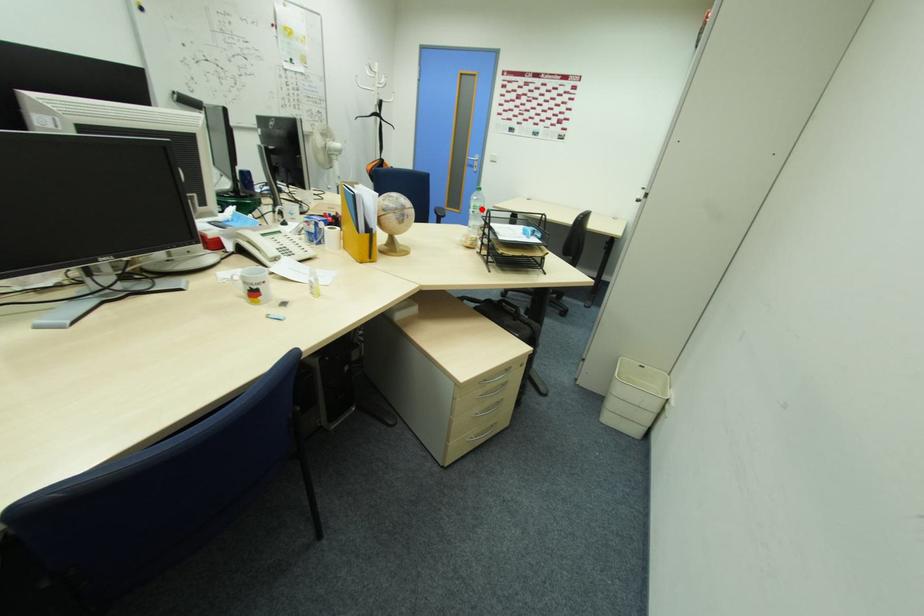
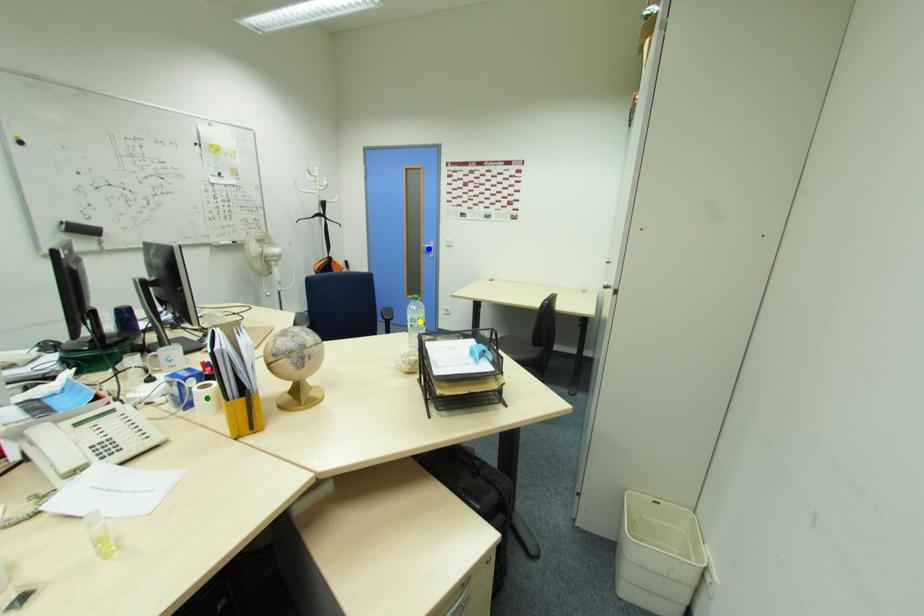
Question: I am providing you with two images of the same scene from different viewpoints. A red point is marked on the first image. You are given multiple points on the second image. In image 2, which mark is for the same physical point as the one in image 1?

Choices:
 (A) green point
 (B) blue point
 (C) yellow point

Answer: (C)